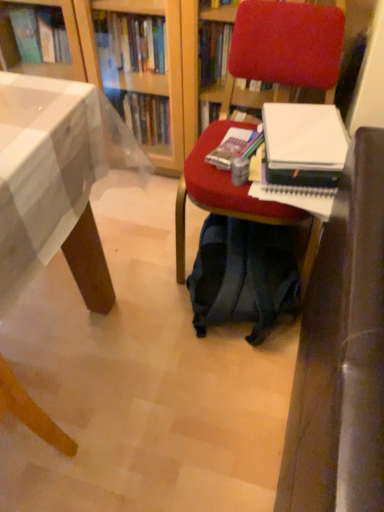
The width and height of the screenshot is (384, 512). I want to click on empty space that is ontop of white paper at center right (from a real-world perspective), so click(x=298, y=134).